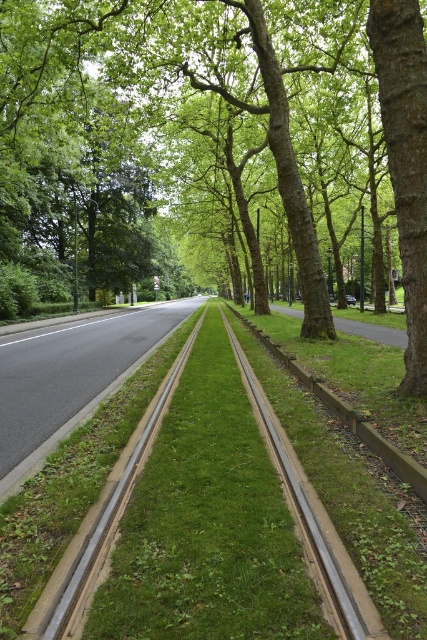
Is green leafy tree at center bigger than metallic silver train track at center?

Yes, green leafy tree at center is bigger than metallic silver train track at center.

This screenshot has height=640, width=427. What are the coordinates of `green leafy tree at center` in the screenshot? It's located at (211, 148).

Is brown rough bark tree at right smaller than metallic silver train track at center?

Correct, brown rough bark tree at right occupies less space than metallic silver train track at center.

Who is more distant from viewer, (404, 10) or (274, 412)?

Positioned behind is point (274, 412).

The image size is (427, 640). In order to click on brown rough bark tree at right in this screenshot , I will do `click(406, 161)`.

Is green leafy tree at center wider than brown rough bark tree at right?

Indeed, green leafy tree at center has a greater width compared to brown rough bark tree at right.

Who is shorter, green leafy tree at center or brown rough bark tree at right?

Standing shorter between the two is brown rough bark tree at right.

The image size is (427, 640). Describe the element at coordinates (211, 148) in the screenshot. I see `green leafy tree at center` at that location.

This screenshot has height=640, width=427. In order to click on green leafy tree at center in this screenshot , I will do `click(211, 148)`.